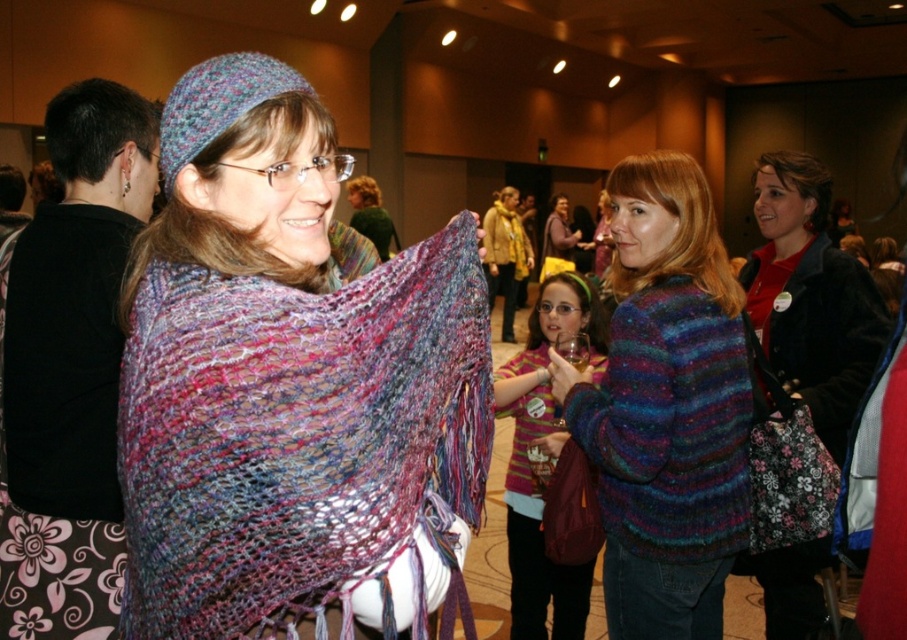
You are an interior designer assessing the layout of the room. You notice the multicolored knitted sweater at center and the striped sweater at center. Which one is placed above the other?

The multicolored knitted sweater at center is positioned over the striped sweater at center, so it is placed above the striped sweater at center.